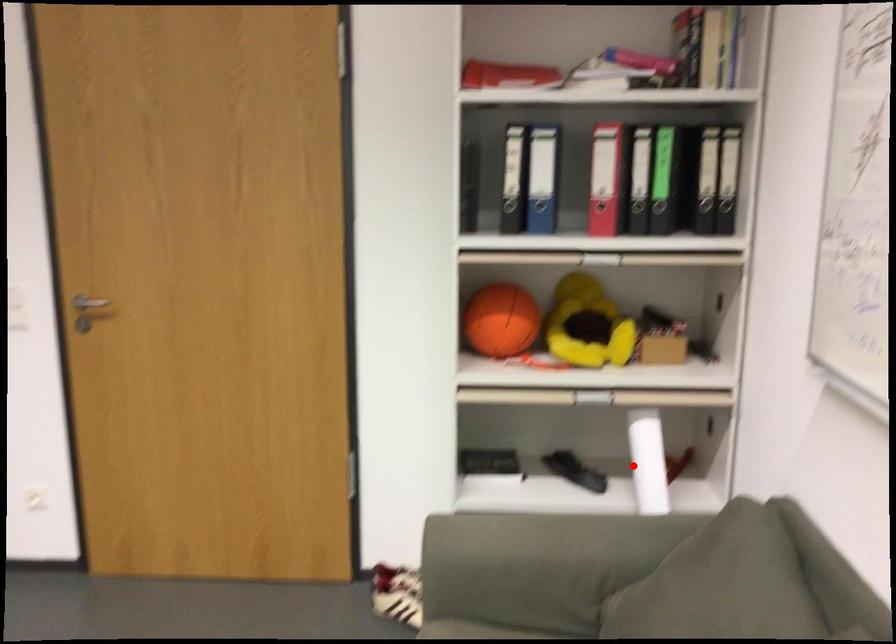
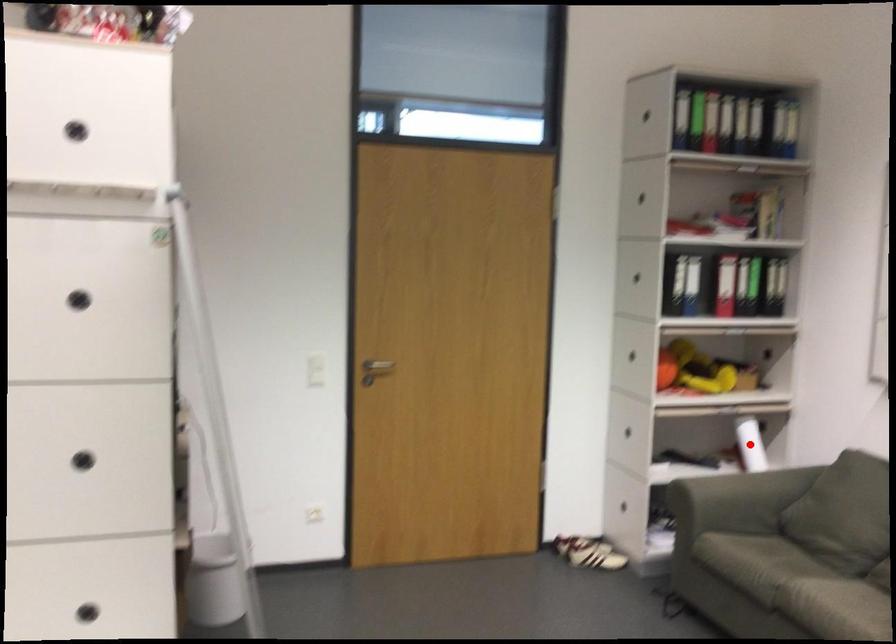
I am providing you with two images of the same scene from different viewpoints. A red point is marked on the first image and another point is marked on the second image. Is the marked point in image1 the same physical position as the marked point in image2?

Yes